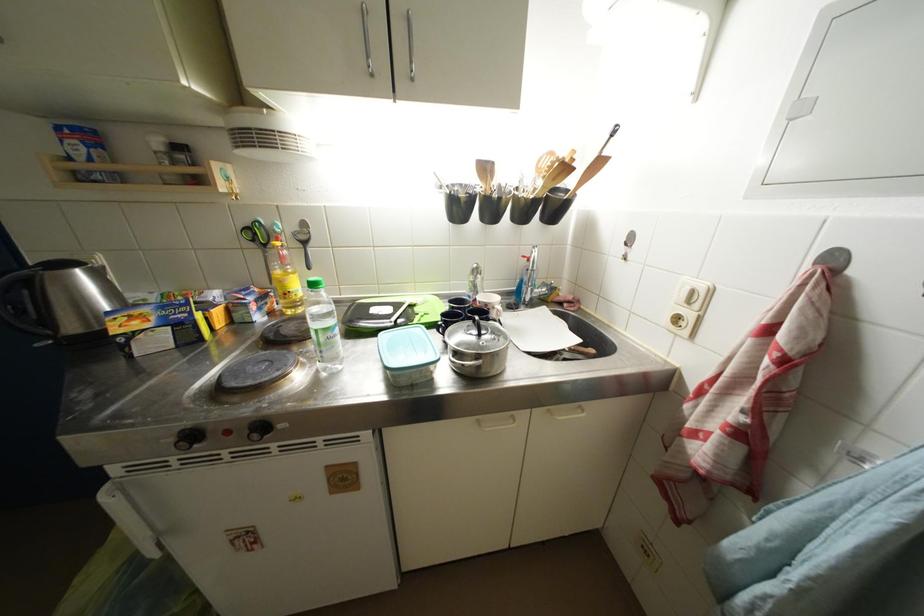
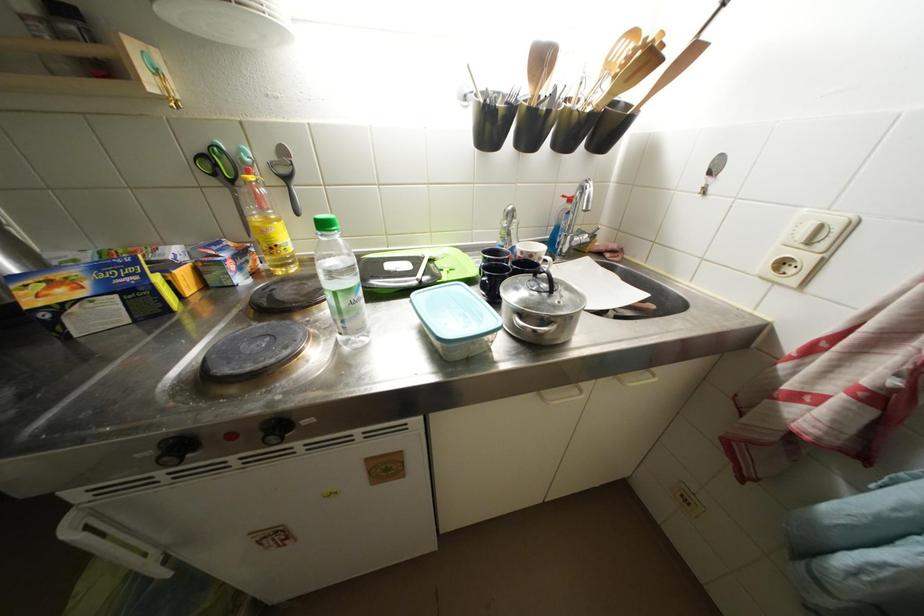
Question: The first image is from the beginning of the video and the second image is from the end. How did the camera likely rotate when shooting the video?

Choices:
 (A) Left
 (B) Right
 (C) Up
 (D) Down

Answer: (D)